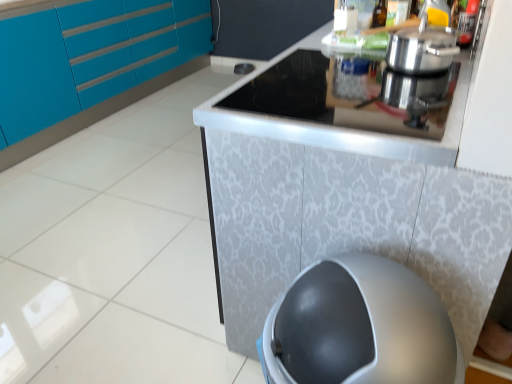
Question: Does silver textured counter at center lie in front of translucent glass bottle at upper center?

Choices:
 (A) yes
 (B) no

Answer: (A)

Question: Can you confirm if silver textured counter at center is positioned to the right of translucent glass bottle at upper center?

Choices:
 (A) yes
 (B) no

Answer: (B)

Question: Is silver textured counter at center next to translucent glass bottle at upper center and touching it?

Choices:
 (A) no
 (B) yes

Answer: (A)

Question: Does silver textured counter at center have a greater height compared to translucent glass bottle at upper center?

Choices:
 (A) no
 (B) yes

Answer: (B)

Question: From a real-world perspective, is silver textured counter at center under translucent glass bottle at upper center?

Choices:
 (A) yes
 (B) no

Answer: (A)

Question: From the image's perspective, is silver textured counter at center located above translucent glass bottle at upper center?

Choices:
 (A) yes
 (B) no

Answer: (B)

Question: Is black glass cooktop at upper center closer to camera compared to translucent glass bottle at upper center?

Choices:
 (A) yes
 (B) no

Answer: (A)

Question: Can you confirm if black glass cooktop at upper center is smaller than translucent glass bottle at upper center?

Choices:
 (A) yes
 (B) no

Answer: (B)

Question: Does black glass cooktop at upper center have a lesser width compared to translucent glass bottle at upper center?

Choices:
 (A) yes
 (B) no

Answer: (B)

Question: From a real-world perspective, is black glass cooktop at upper center located higher than translucent glass bottle at upper center?

Choices:
 (A) yes
 (B) no

Answer: (B)

Question: From the image's perspective, would you say black glass cooktop at upper center is shown under translucent glass bottle at upper center?

Choices:
 (A) no
 (B) yes

Answer: (B)

Question: From a real-world perspective, is black glass cooktop at upper center under translucent glass bottle at upper center?

Choices:
 (A) yes
 (B) no

Answer: (A)

Question: Is black glass cooktop at upper center completely or partially inside translucent glass bottle at upper center?

Choices:
 (A) no
 (B) yes

Answer: (A)